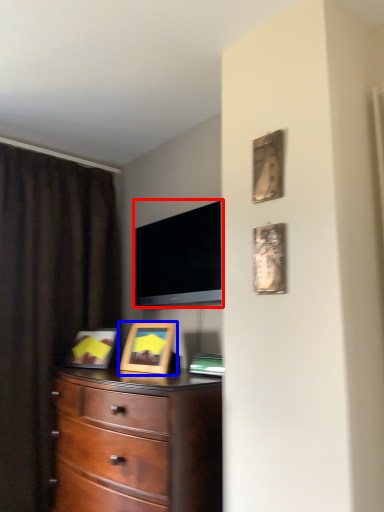
Question: Which of the following is the closest to the observer, television (highlighted by a red box) or picture frame (highlighted by a blue box)?

Choices:
 (A) television
 (B) picture frame

Answer: (A)